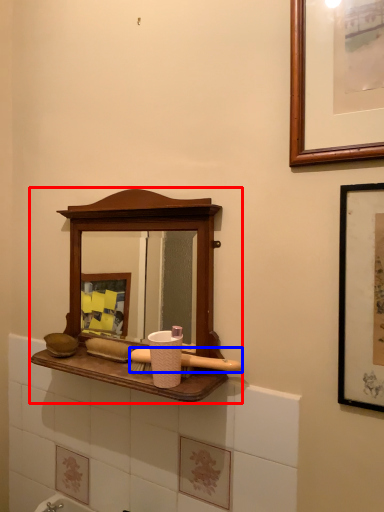
Question: Which of the following is the farthest to the observer, medicine cabinet (highlighted by a red box) or brush (highlighted by a blue box)?

Choices:
 (A) medicine cabinet
 (B) brush

Answer: (B)